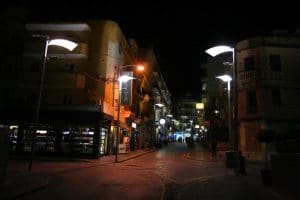
Identify the location of wall. This screenshot has height=200, width=300. (110, 99).